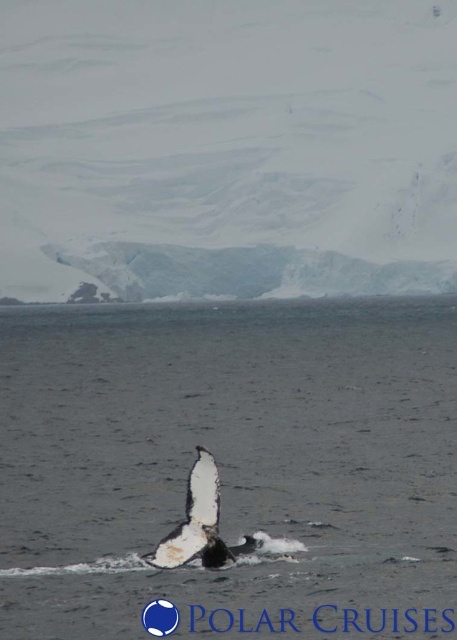
Question: Does clear water at center have a lesser width compared to white matte whale at center?

Choices:
 (A) yes
 (B) no

Answer: (B)

Question: Which point appears closest to the camera in this image?

Choices:
 (A) (250, 307)
 (B) (164, 547)

Answer: (B)

Question: Considering the relative positions of clear water at center and white matte whale at center in the image provided, where is clear water at center located with respect to white matte whale at center?

Choices:
 (A) left
 (B) right

Answer: (B)

Question: Among these objects, which one is nearest to the camera?

Choices:
 (A) white matte whale at center
 (B) clear water at center

Answer: (A)

Question: Is clear water at center above white matte whale at center?

Choices:
 (A) yes
 (B) no

Answer: (A)